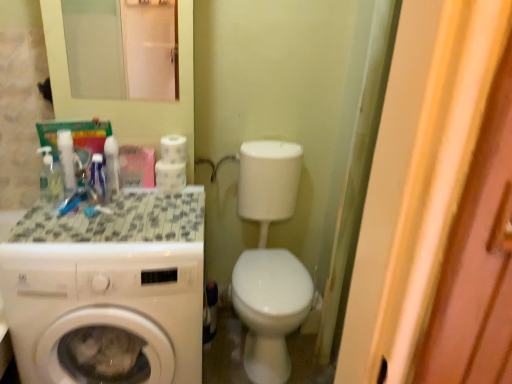
Where is `free space above white glossy washing machine at left (from a real-world perspective)`? This screenshot has height=384, width=512. free space above white glossy washing machine at left (from a real-world perspective) is located at coordinates (102, 220).